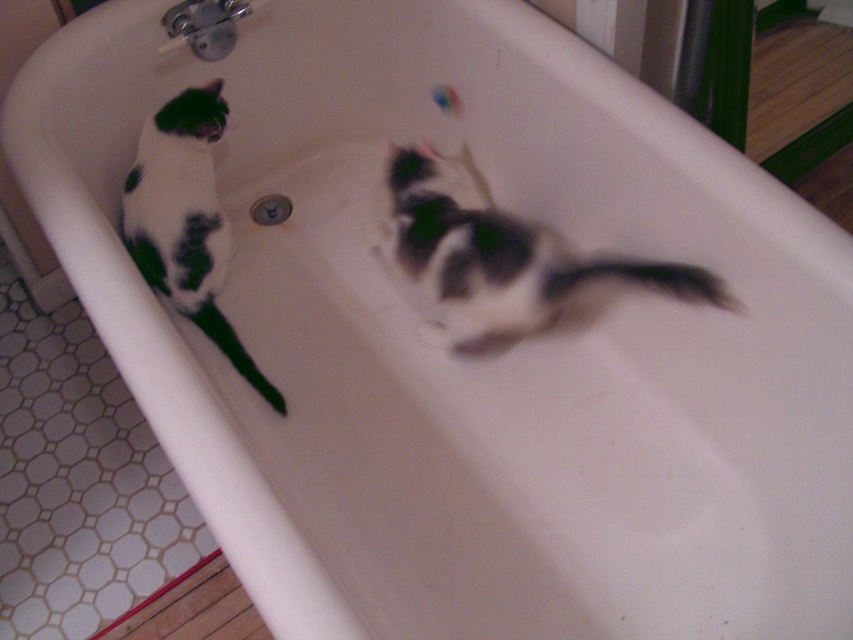
Does white fur cat at center have a smaller size compared to black-and-white fur cat at left?

No, white fur cat at center is not smaller than black-and-white fur cat at left.

Which is behind, point (416, 150) or point (213, 308)?

Positioned behind is point (416, 150).

Which is in front, point (474, 346) or point (163, 134)?

Point (163, 134) is in front.

You are a GUI agent. You are given a task and a screenshot of the screen. Output one action in this format:
    pyautogui.click(x=<x>, y=<y>)
    Task: Click on the white fur cat at center
    The image size is (853, 640).
    Given the screenshot: What is the action you would take?
    pyautogui.click(x=502, y=256)

Is black-and-white fur cat at left positioned behind black matte tail at left?

No, black-and-white fur cat at left is in front of black matte tail at left.

How far apart are black-and-white fur cat at left and black matte tail at left?

They are 4.86 inches apart.

Between point (152, 246) and point (202, 301), which one is positioned in front?

Point (152, 246) is in front.

Image resolution: width=853 pixels, height=640 pixels. Find the location of `black-and-white fur cat at left`. black-and-white fur cat at left is located at coordinates (184, 220).

Which of these two, white fur cat at center or black fur tail at lower right, stands shorter?

black fur tail at lower right

Which is in front, point (553, 237) or point (653, 284)?

Positioned in front is point (653, 284).

Between point (567, 282) and point (637, 266), which one is positioned in front?

Point (567, 282) is in front.

Where is `white fur cat at center`? white fur cat at center is located at coordinates (502, 256).